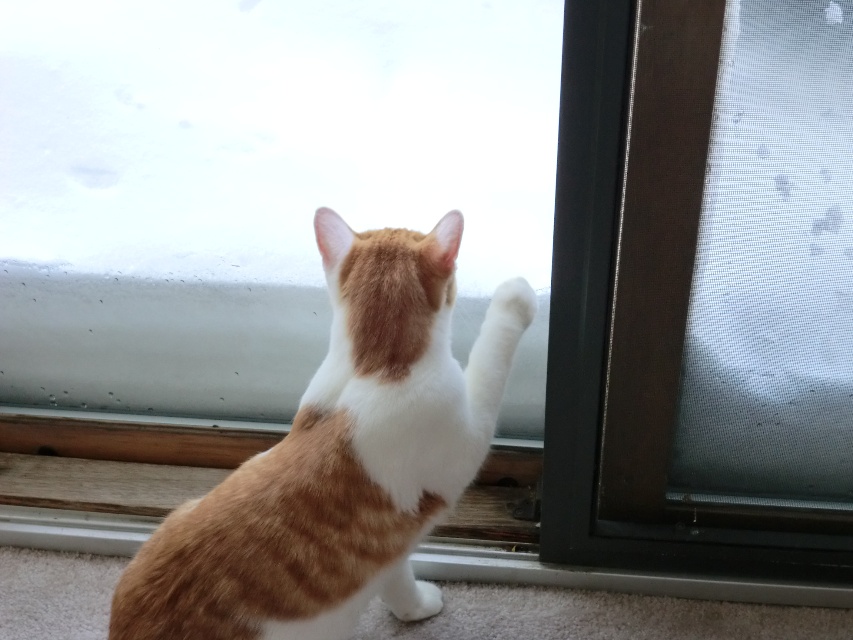
You are taking a photo of the scene and want to focus on both the point at (840, 269) and the point at (486, 397). Which point should you focus on first to ensure both are in sharp focus?

You should focus on point (486, 397) first because it is closer to the camera than point (840, 269). By focusing on the closer point, the further point will also be in focus due to the depth of field.